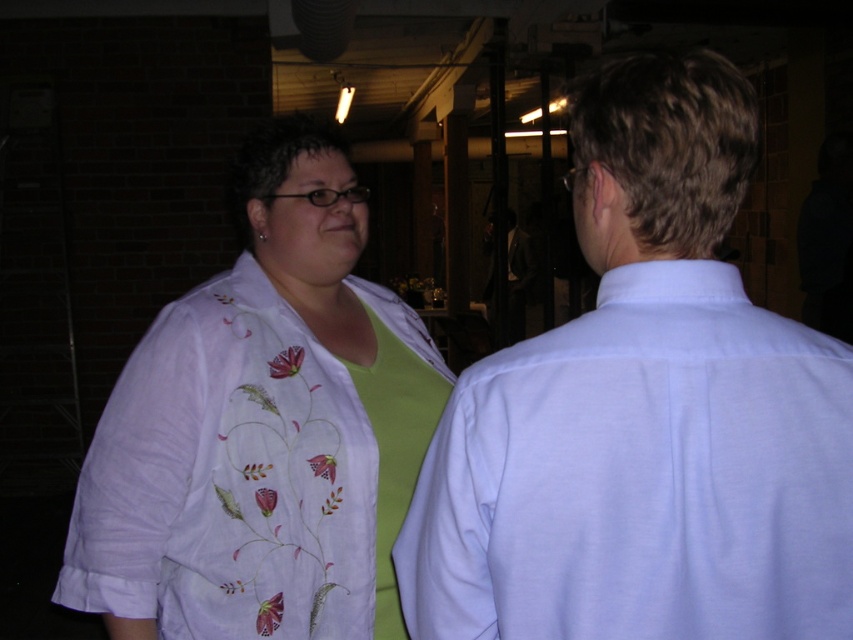
You are organizing a clothing display and need to place the white smooth shirt at center and the white embroidered blouse at left on a mannequin. Since the mannequin can only accommodate one item at a time, which item should you choose if you want to display the wider clothing first?

The white embroidered blouse at left should be displayed first because its width is greater than the white smooth shirt at center.